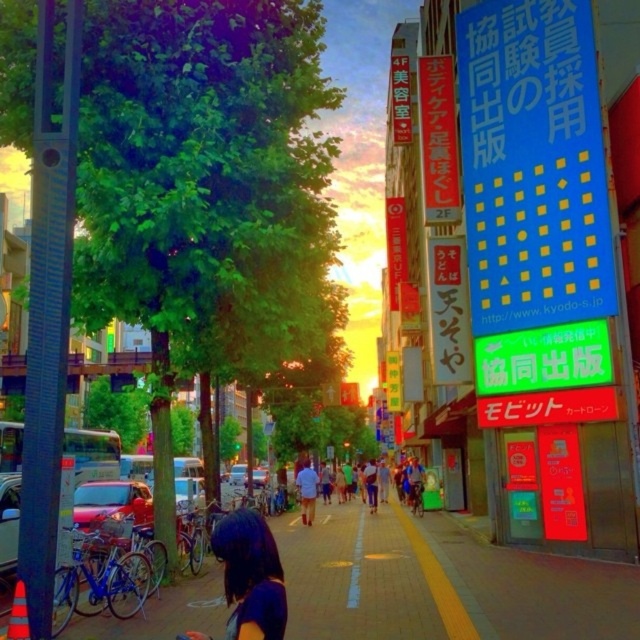
Question: In this image, where is denim shorts at center located relative to light blue shirt at center?

Choices:
 (A) above
 (B) below

Answer: (B)

Question: Can you confirm if brick pavement at center is bigger than light blue shirt at center?

Choices:
 (A) no
 (B) yes

Answer: (B)

Question: Does brick pavement at center appear on the left side of light blue shirt at center?

Choices:
 (A) no
 (B) yes

Answer: (A)

Question: Based on their relative distances, which object is nearer to the dark purple hair at lower center?

Choices:
 (A) brick pavement at center
 (B) denim shorts at center

Answer: (A)

Question: Which point appears closest to the camera in this image?

Choices:
 (A) (324, 499)
 (B) (301, 483)
 (C) (166, 624)

Answer: (C)

Question: Among these objects, which one is farthest from the camera?

Choices:
 (A) light blue shirt at center
 (B) brick pavement at center
 (C) denim shorts at center

Answer: (C)